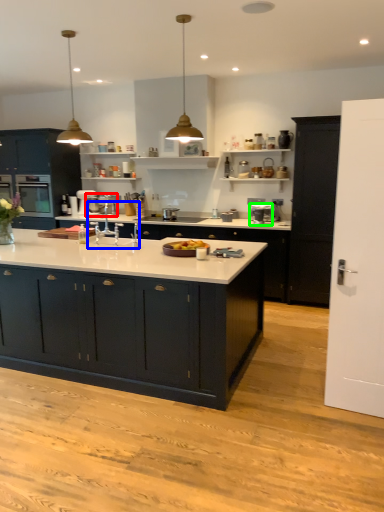
Question: Considering the real-world distances, which object is closest to appliance (highlighted by a red box)? sink (highlighted by a blue box) or appliance (highlighted by a green box).

Choices:
 (A) sink
 (B) appliance

Answer: (A)